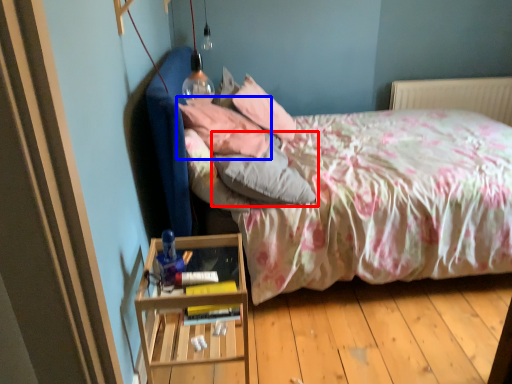
Question: Which of the following is the farthest to the observer, pillow (highlighted by a red box) or pillow (highlighted by a blue box)?

Choices:
 (A) pillow
 (B) pillow

Answer: (B)